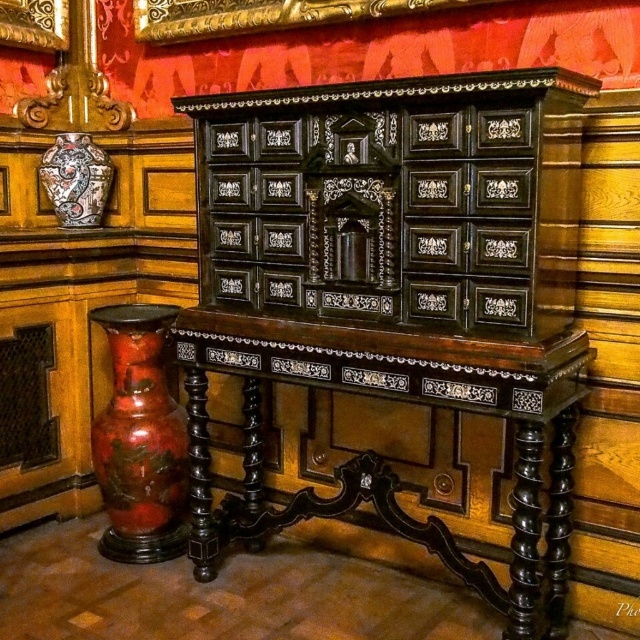
Is rustic terracotta vase at left shorter than decorative ceramic vase at left?

No, rustic terracotta vase at left is not shorter than decorative ceramic vase at left.

Between point (157, 316) and point (86, 180), which one is positioned in front?

Positioned in front is point (157, 316).

Describe the element at coordinates (140, 440) in the screenshot. Image resolution: width=640 pixels, height=640 pixels. I see `rustic terracotta vase at left` at that location.

This screenshot has width=640, height=640. Identify the location of rustic terracotta vase at left. (140, 440).

Which is below, rustic terracotta vase at left or gold ornate picture frame at upper center?

rustic terracotta vase at left

Can you confirm if rustic terracotta vase at left is positioned to the right of gold ornate picture frame at upper center?

Indeed, rustic terracotta vase at left is positioned on the right side of gold ornate picture frame at upper center.

Who is more distant from viewer, (106, 321) or (67, 1)?

The point (67, 1) is behind.

I want to click on rustic terracotta vase at left, so click(x=140, y=440).

Who is more distant from viewer, (67, 211) or (35, 28)?

Point (35, 28)

You are a GUI agent. You are given a task and a screenshot of the screen. Output one action in this format:
    pyautogui.click(x=<x>, y=<y>)
    Task: Click on the decorative ceramic vase at left
    
    Given the screenshot: What is the action you would take?
    pyautogui.click(x=76, y=179)

Find the location of a particular element. decorative ceramic vase at left is located at coordinates (76, 179).